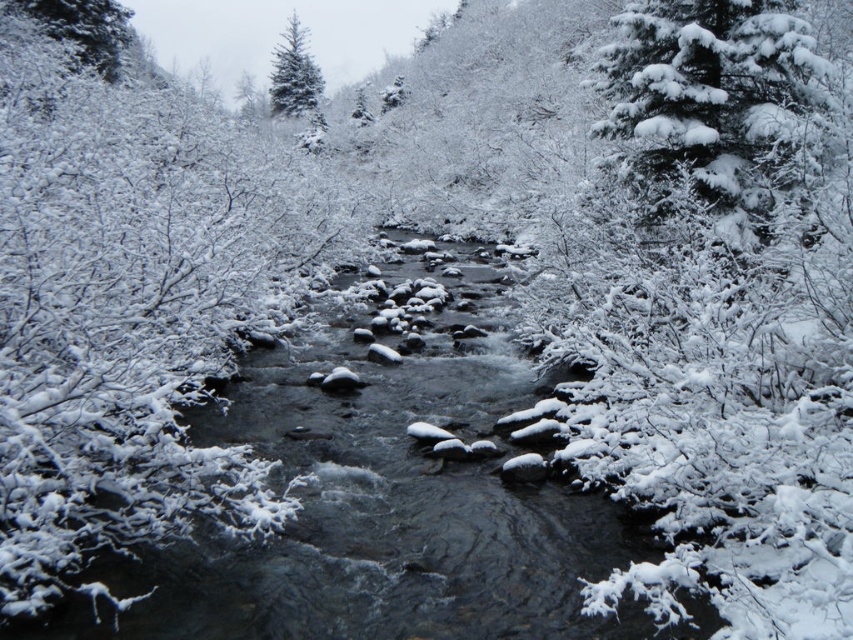
Does snow-covered evergreen tree at upper left appear on the right side of green matte evergreen tree at upper center?

Indeed, snow-covered evergreen tree at upper left is positioned on the right side of green matte evergreen tree at upper center.

Which is below, snow-covered evergreen tree at upper left or green matte evergreen tree at upper center?

snow-covered evergreen tree at upper left

Which is behind, point (94, 17) or point (279, 65)?

Point (279, 65)

Where is `snow-covered evergreen tree at upper left`? snow-covered evergreen tree at upper left is located at coordinates (86, 28).

From the picture: Can you confirm if snow-covered evergreen at upper right is thinner than snow-covered evergreen tree at upper left?

Yes, snow-covered evergreen at upper right is thinner than snow-covered evergreen tree at upper left.

Is snow-covered evergreen at upper right to the right of snow-covered evergreen tree at upper left from the viewer's perspective?

Correct, you'll find snow-covered evergreen at upper right to the right of snow-covered evergreen tree at upper left.

Locate an element on the screen. The height and width of the screenshot is (640, 853). snow-covered evergreen at upper right is located at coordinates (711, 106).

Who is shorter, snow-covered evergreen at upper right or green matte evergreen tree at upper center?

snow-covered evergreen at upper right

Is point (759, 88) closer to camera compared to point (312, 81)?

That is True.

Between point (730, 52) and point (279, 112), which one is positioned in front?

Point (730, 52) is more forward.

Find the location of a particular element. The width and height of the screenshot is (853, 640). snow-covered evergreen at upper right is located at coordinates (711, 106).